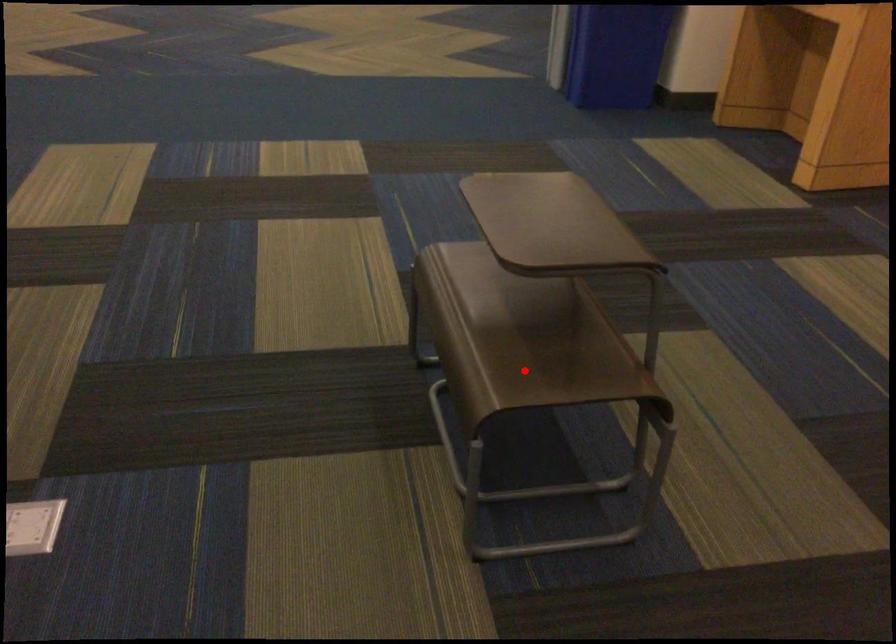
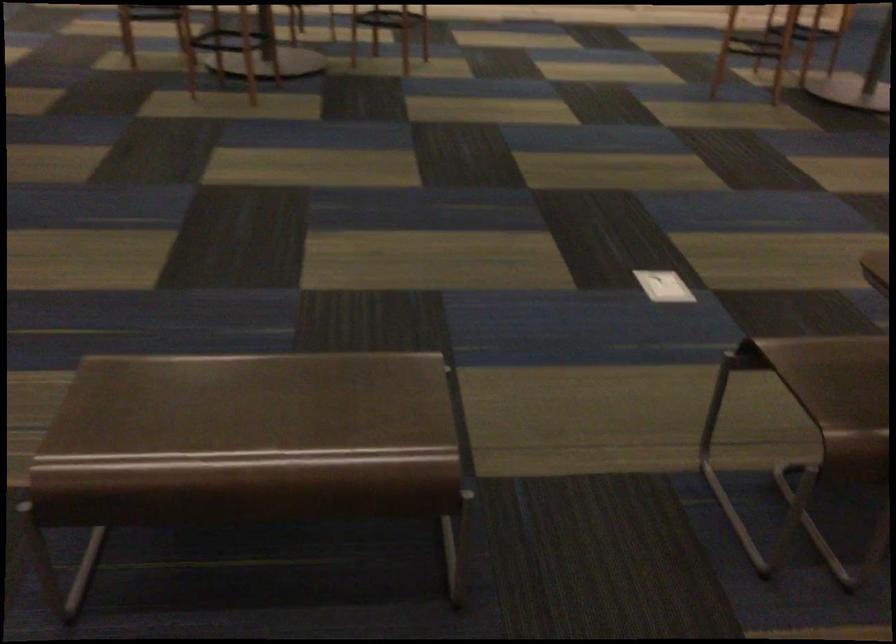
Question: I am providing you with two images of the same scene from different viewpoints. A red point is marked on the first image. Is the red point's position out of view in image 2?

Choices:
 (A) Yes
 (B) No

Answer: (B)